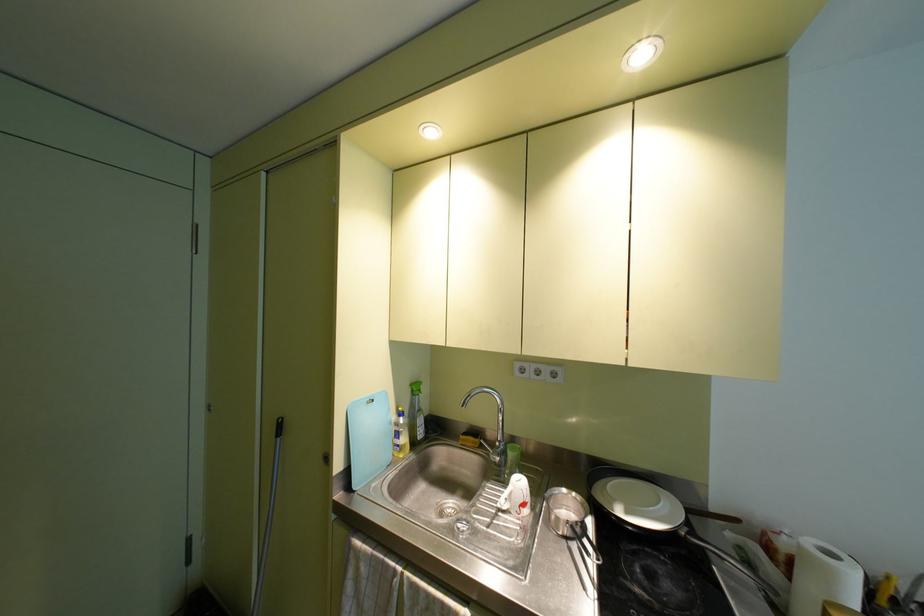
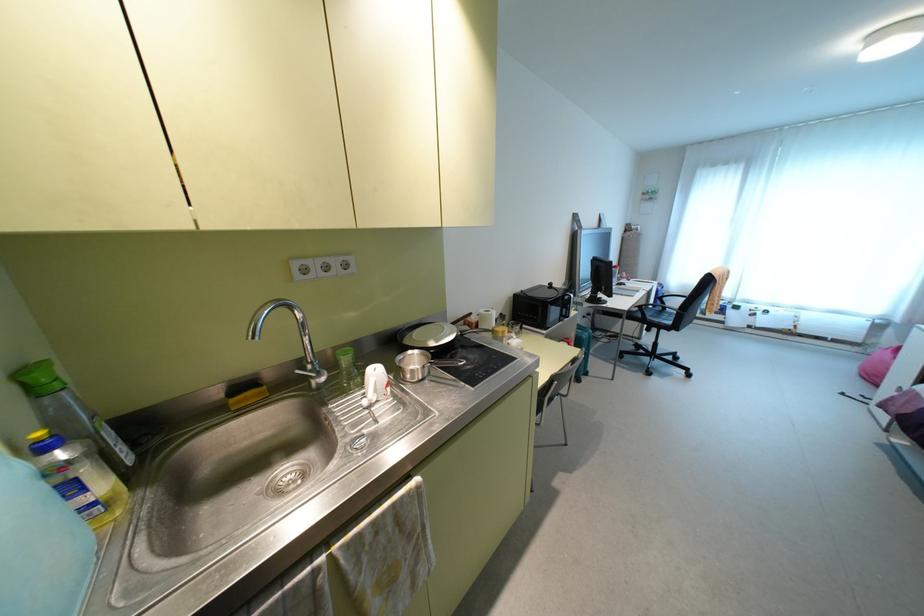
Where in the second image is the point corresponding to point (499, 440) from the first image?

(310, 362)